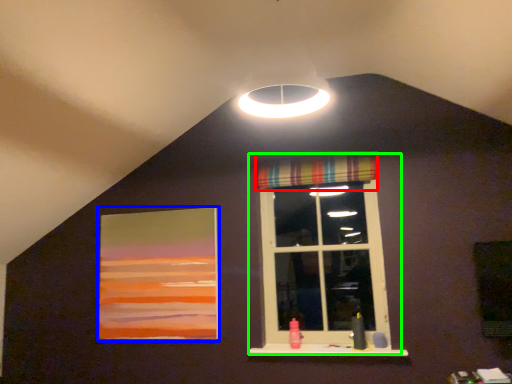
Question: Which object is the farthest from curtain (highlighted by a red box)? Choose among these: picture frame (highlighted by a blue box) or window (highlighted by a green box).

Choices:
 (A) picture frame
 (B) window

Answer: (A)